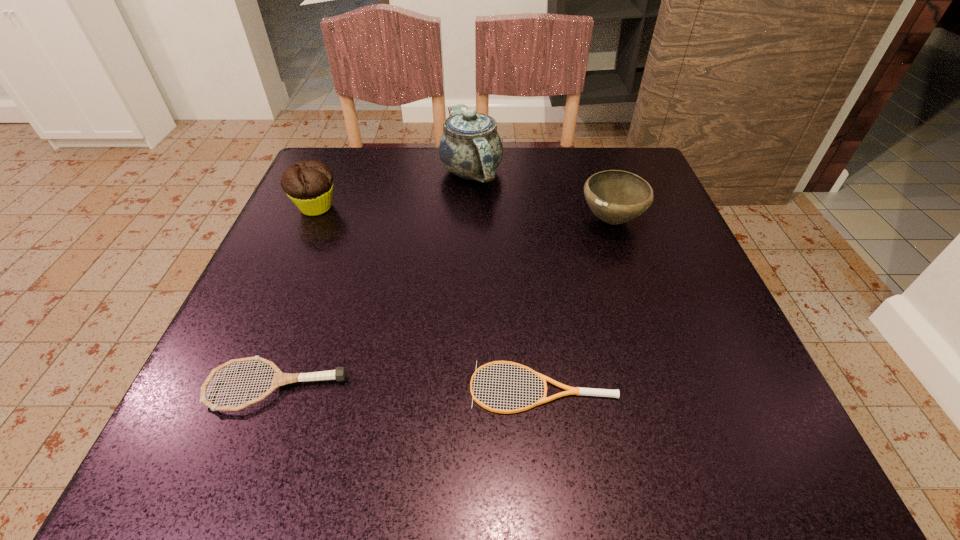
Locate an element on the screen. the tallest object is located at coordinates (470, 147).

You are a GUI agent. You are given a task and a screenshot of the screen. Output one action in this format:
    pyautogui.click(x=<x>, y=<y>)
    Task: Click on the fourth shortest object
    
    Given the screenshot: What is the action you would take?
    pyautogui.click(x=309, y=184)

Image resolution: width=960 pixels, height=540 pixels. Identify the location of the third shortest object. (615, 196).

You are a GUI agent. You are given a task and a screenshot of the screen. Output one action in this format:
    pyautogui.click(x=<x>, y=<y>)
    Task: Click on the bowl
    The width and height of the screenshot is (960, 540).
    Given the screenshot: What is the action you would take?
    [615, 196]

At what (x,y) coordinates should I click in order to perform the action: click on the left tennis racket. Please return your answer as a coordinate pair (x, y). Looking at the image, I should click on (279, 379).

This screenshot has height=540, width=960. I want to click on the taller tennis racket, so click(279, 379).

I want to click on the shorter tennis racket, so point(571,390).

You are a GUI agent. You are given a task and a screenshot of the screen. Output one action in this format:
    pyautogui.click(x=<x>, y=<y>)
    Task: Click on the shortest object
    The height and width of the screenshot is (540, 960).
    Given the screenshot: What is the action you would take?
    pyautogui.click(x=571, y=390)

The width and height of the screenshot is (960, 540). I want to click on free spot located 0.370m from the spout of the chinaware, so click(467, 333).

The height and width of the screenshot is (540, 960). What are the coordinates of `vacant space located 0.130m on the back of the second tallest object` in the screenshot? It's located at (335, 163).